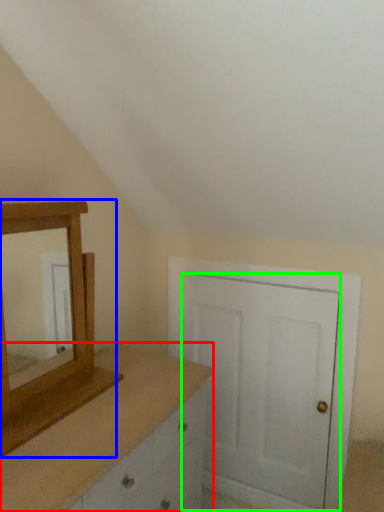
Question: Which object is the closest to the chest of drawers (highlighted by a red box)? Choose among these: medicine cabinet (highlighted by a blue box) or door (highlighted by a green box).

Choices:
 (A) medicine cabinet
 (B) door

Answer: (A)